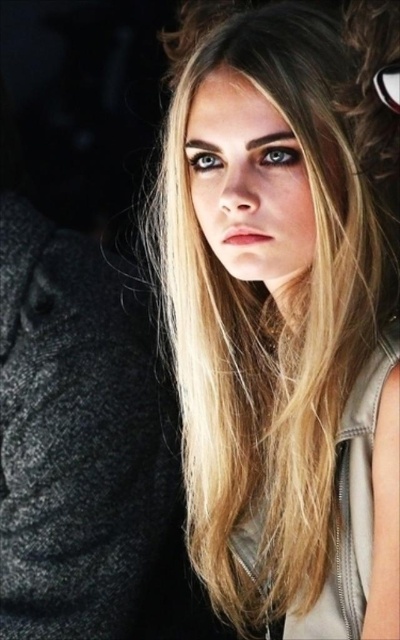
You are an artist trying to sketch the person in the image. The point at coordinates (266, 301) is important for locating the blonde hair. Where exactly should you place this point on your sketch?

The point at coordinates (266, 301) marks the center of the blonde hair, so you should place it at the center of the blonde hair in your sketch.

You are a photographer adjusting lighting for a portrait. You notice the blonde hair at center and the black plastic goggles at upper right. Which object would cast a larger shadow under the same lighting conditions?

The blonde hair at center would cast a larger shadow than the black plastic goggles at upper right because it is bigger in size.

You are a photographer adjusting lighting for a portrait. You notice the blonde hair at center and the black plastic goggles at upper right. Which object is closer to the camera?

The blonde hair at center is closer to the camera because the black plastic goggles at upper right is behind it.